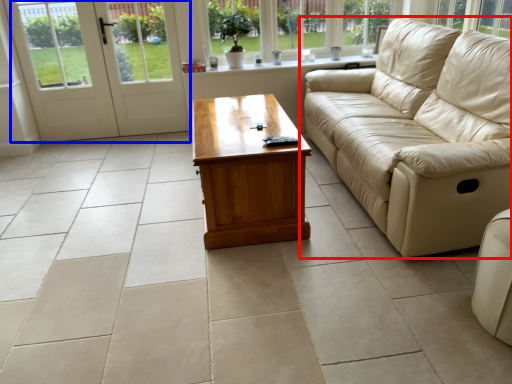
Question: Which of the following is the closest to the observer, studio couch (highlighted by a red box) or door (highlighted by a blue box)?

Choices:
 (A) studio couch
 (B) door

Answer: (A)